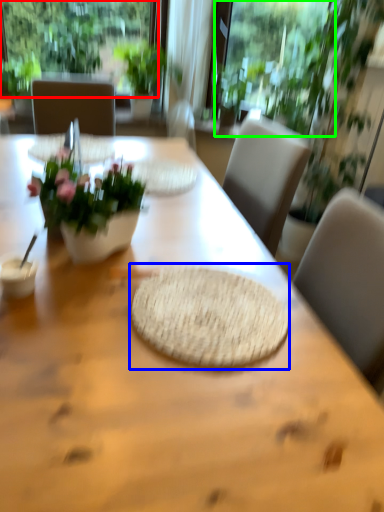
Question: Based on their relative distances, which object is farther from window (highlighted by a red box)? Choose from mat (highlighted by a blue box) and window screen (highlighted by a green box).

Choices:
 (A) mat
 (B) window screen

Answer: (A)